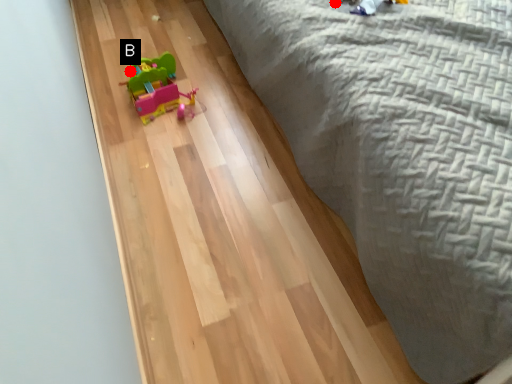
Question: Two points are circled on the image, labeled by A and B beside each circle. Which of the following is the farthest from the observer?

Choices:
 (A) A is further
 (B) B is further

Answer: (B)